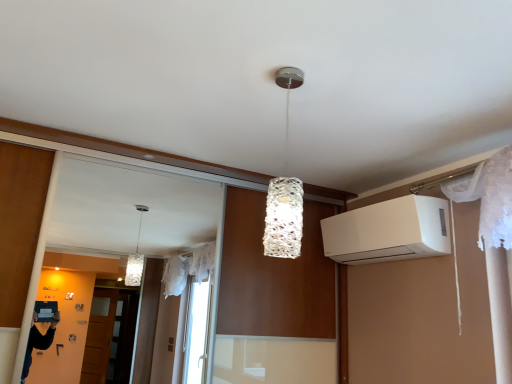
Question: Visually, is white textured lamp at center positioned to the left or to the right of white matte air conditioner at upper right?

Choices:
 (A) right
 (B) left

Answer: (B)

Question: From the image's perspective, relative to white matte air conditioner at upper right, is white textured lamp at center above or below?

Choices:
 (A) above
 (B) below

Answer: (A)

Question: Is point (281, 84) closer or farther from the camera than point (347, 223)?

Choices:
 (A) closer
 (B) farther

Answer: (A)

Question: Considering the positions of white matte air conditioner at upper right and white textured lamp at center in the image, is white matte air conditioner at upper right wider or thinner than white textured lamp at center?

Choices:
 (A) thin
 (B) wide

Answer: (B)

Question: Is point (360, 215) closer or farther from the camera than point (287, 82)?

Choices:
 (A) farther
 (B) closer

Answer: (A)

Question: Based on their positions, is white matte air conditioner at upper right located to the left or right of white textured lamp at center?

Choices:
 (A) right
 (B) left

Answer: (A)

Question: Is white matte air conditioner at upper right bigger or smaller than white textured lamp at center?

Choices:
 (A) big
 (B) small

Answer: (A)